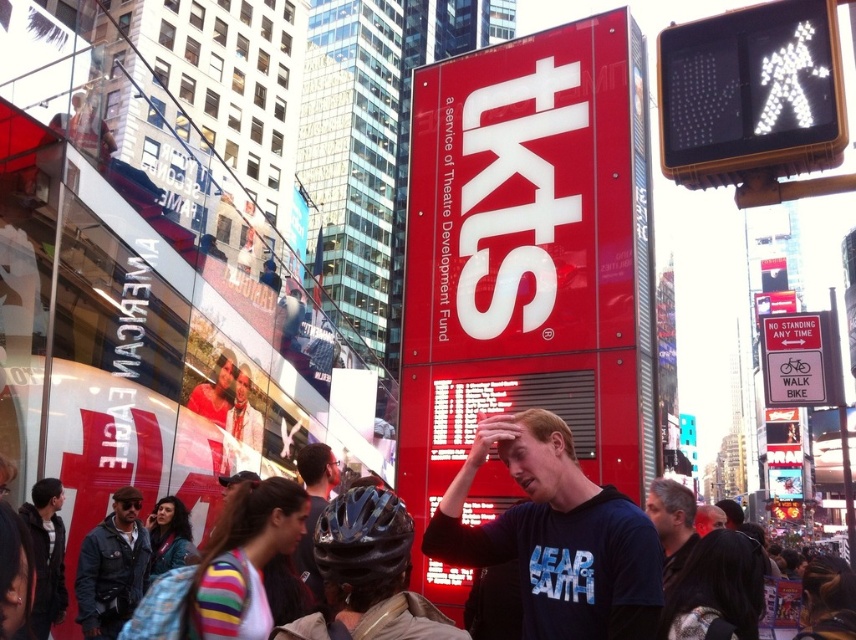
You are a photographer standing in Times Square. You want to take a photo that includes both the red plastic sign at upper right and the dark blue helmet at center. Which object should you focus on first to ensure both are in sharp focus?

You should focus on the dark blue helmet at center first because it is closer to you than the red plastic sign at upper right, which is further away. This way, both objects will be in focus as the helmet is nearer and the sign is farther, creating a depth of field that includes both.

You are standing in Times Square and see two points marked on the TKTS sign. The first point is at coordinates point (36, 189) and the second point is at point (354, 529). Which point is closer to you?

Point (354, 529) is closer to you because it is less further to the camera than point (36, 189).